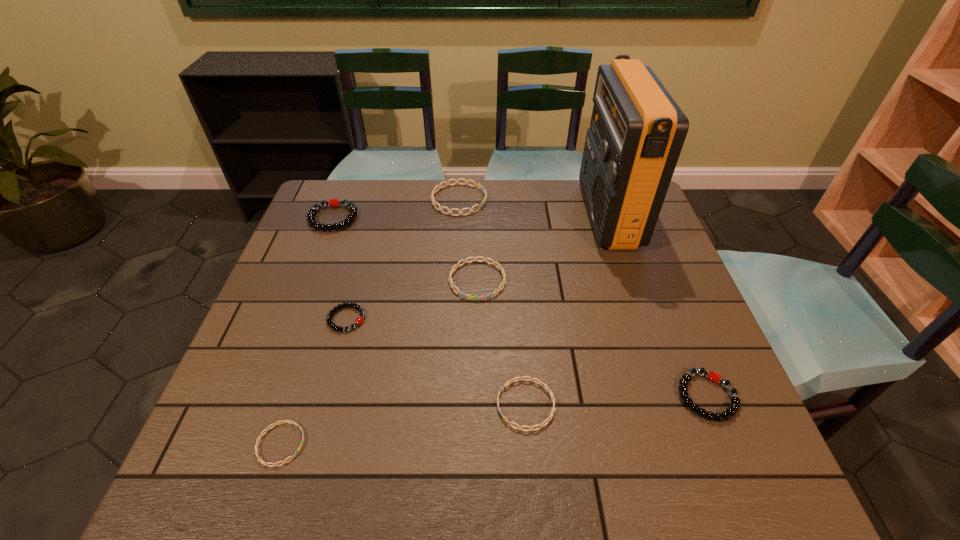
Locate which blue bracelet is the third closest to the leftmost blue bracelet. Please provide its 2D coordinates. Your answer should be formatted as a tuple, i.e. [(x, y)], where the tuple contains the x and y coordinates of a point satisfying the conditions above.

[(480, 187)]

At what (x,y) coordinates should I click in order to perform the action: click on blue bracelet object that ranks as the third closest to the second farthest blue bracelet. Please return your answer as a coordinate pair (x, y). This screenshot has height=540, width=960. Looking at the image, I should click on (257, 442).

Locate which black bracelet ranks in proximity to the second nearest black bracelet. Please provide its 2D coordinates. Your answer should be formatted as a tuple, i.e. [(x, y)], where the tuple contains the x and y coordinates of a point satisfying the conditions above.

[(335, 202)]

Identify which black bracelet is the third closest to the third biggest blue bracelet. Please provide its 2D coordinates. Your answer should be formatted as a tuple, i.e. [(x, y)], where the tuple contains the x and y coordinates of a point satisfying the conditions above.

[(335, 202)]